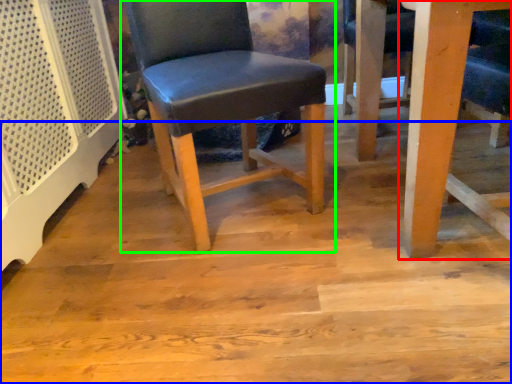
Question: Based on their relative distances, which object is farther from table (highlighted by a red box)? Choose from plywood (highlighted by a blue box) and chair (highlighted by a green box).

Choices:
 (A) plywood
 (B) chair

Answer: (B)